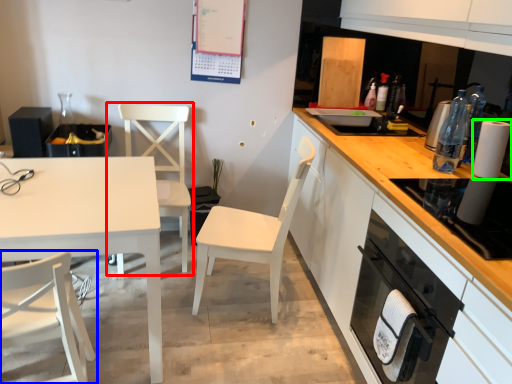
Question: Which object is positioned closest to chair (highlighted by a red box)? Select from chair (highlighted by a blue box) and paper towel (highlighted by a green box).

Choices:
 (A) chair
 (B) paper towel

Answer: (A)